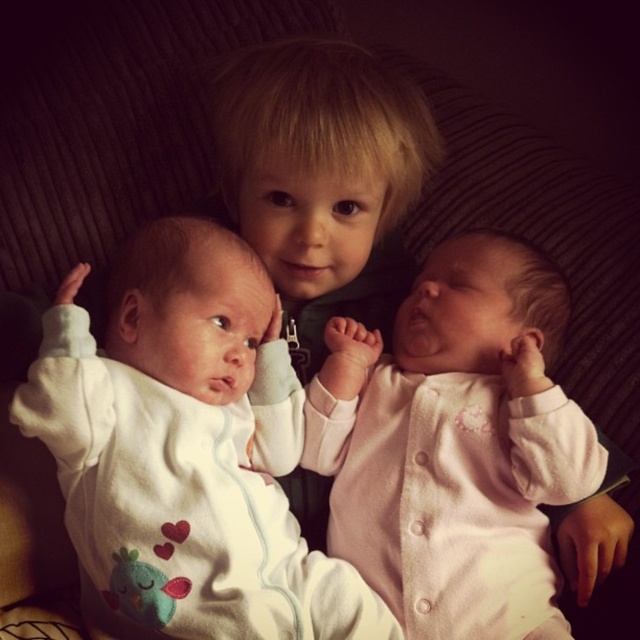
Question: Does white soft onesie at center appear over blonde hair at center?

Choices:
 (A) yes
 (B) no

Answer: (B)

Question: Considering the real-world distances, which object is closest to the pink matte onesie at center?

Choices:
 (A) white soft onesie at center
 (B) blonde hair at center

Answer: (A)

Question: Is pink matte onesie at center below blonde hair at center?

Choices:
 (A) no
 (B) yes

Answer: (B)

Question: Which point is closer to the camera?

Choices:
 (A) (381, 342)
 (B) (260, 604)
 (C) (336, 230)

Answer: (B)

Question: Does white soft onesie at center have a larger size compared to pink matte onesie at center?

Choices:
 (A) yes
 (B) no

Answer: (A)

Question: Which point is closer to the camera?

Choices:
 (A) (348, 124)
 (B) (323, 417)
 (C) (252, 531)

Answer: (C)